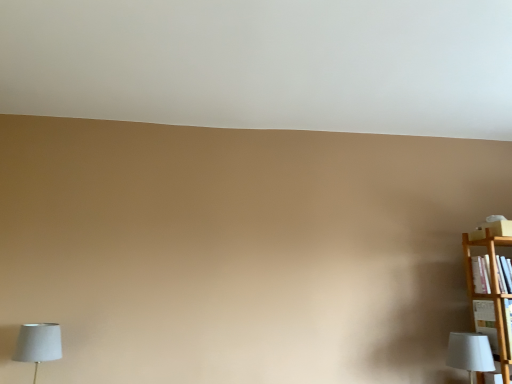
Question: Is white fabric lampshade at lower left, positioned as the 2th lamp in right-to-left order, completely or partially outside of wooden bookshelf at right?

Choices:
 (A) yes
 (B) no

Answer: (A)

Question: Considering the relative sizes of white fabric lampshade at lower left, the first lamp when ordered from left to right, and wooden bookshelf at right in the image provided, is white fabric lampshade at lower left, the first lamp when ordered from left to right, smaller than wooden bookshelf at right?

Choices:
 (A) no
 (B) yes

Answer: (A)

Question: Is the position of white fabric lampshade at lower left, positioned as the 2th lamp in right-to-left order, more distant than that of wooden bookshelf at right?

Choices:
 (A) no
 (B) yes

Answer: (A)

Question: From a real-world perspective, is white fabric lampshade at lower left, the first lamp when ordered from left to right, positioned over wooden bookshelf at right based on gravity?

Choices:
 (A) no
 (B) yes

Answer: (A)

Question: Is white fabric lampshade at lower left, positioned as the 2th lamp in right-to-left order, turned away from wooden bookshelf at right?

Choices:
 (A) no
 (B) yes

Answer: (A)

Question: From the image's perspective, is white fabric lampshade at lower left, the first lamp when ordered from left to right, located beneath wooden bookshelf at right?

Choices:
 (A) no
 (B) yes

Answer: (B)

Question: Considering the relative sizes of white fabric lampshade at lower right, the first lamp viewed from the right, and wooden bookshelf at right in the image provided, is white fabric lampshade at lower right, the first lamp viewed from the right, wider than wooden bookshelf at right?

Choices:
 (A) yes
 (B) no

Answer: (A)

Question: From a real-world perspective, is white fabric lampshade at lower right, the first lamp viewed from the right, beneath wooden bookshelf at right?

Choices:
 (A) yes
 (B) no

Answer: (A)

Question: From the image's perspective, is white fabric lampshade at lower right, the first lamp viewed from the right, located above wooden bookshelf at right?

Choices:
 (A) yes
 (B) no

Answer: (B)

Question: Does white fabric lampshade at lower right, the second lamp positioned from the left, have a lesser height compared to wooden bookshelf at right?

Choices:
 (A) no
 (B) yes

Answer: (A)

Question: Is white fabric lampshade at lower right, the second lamp positioned from the left, positioned before wooden bookshelf at right?

Choices:
 (A) yes
 (B) no

Answer: (A)

Question: Considering the relative positions of white fabric lampshade at lower right, the second lamp positioned from the left, and wooden bookshelf at right in the image provided, is white fabric lampshade at lower right, the second lamp positioned from the left, to the left of wooden bookshelf at right from the viewer's perspective?

Choices:
 (A) no
 (B) yes

Answer: (B)

Question: Is wooden bookshelf at right further to camera compared to white fabric lampshade at lower right, the first lamp viewed from the right?

Choices:
 (A) yes
 (B) no

Answer: (A)